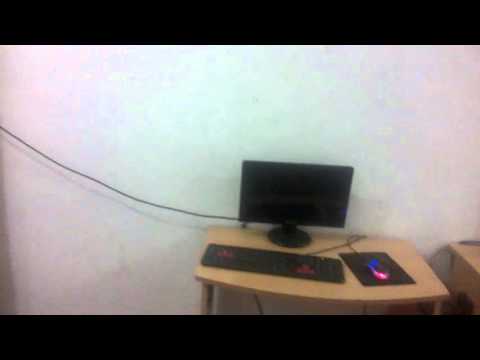
In order to click on mouse in this screenshot , I will do `click(379, 269)`.